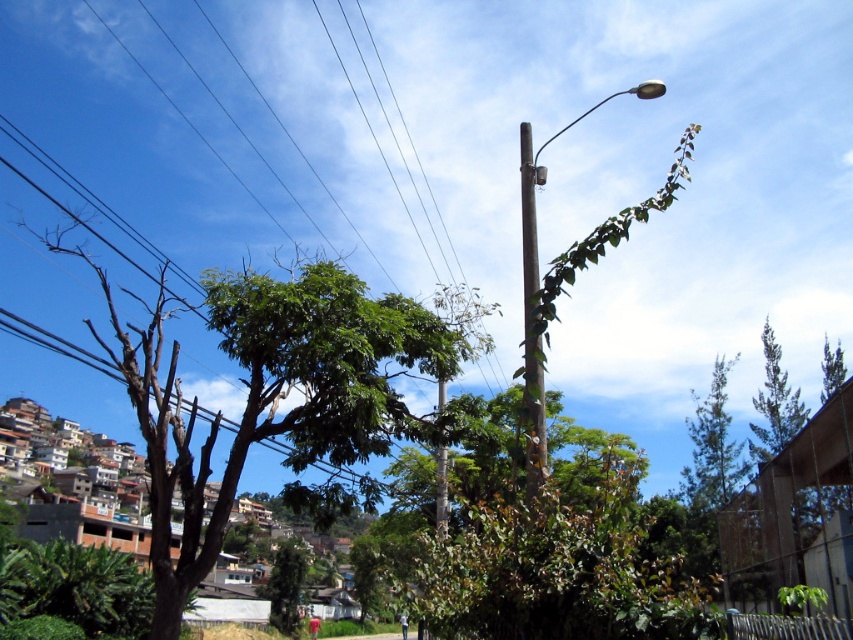
You are standing in the middle of the scene and want to take a photo of the green leafy tree at lower center without the brown wooden telegraph pole at center blocking it. Which direction should you move to achieve this?

Since the brown wooden telegraph pole at center is closer to the viewer than the green leafy tree at lower center, moving to the side away from the pole would allow you to position yourself so that the pole is no longer in front of the tree. Moving to the left or right, away from the center, would help avoid the obstruction.